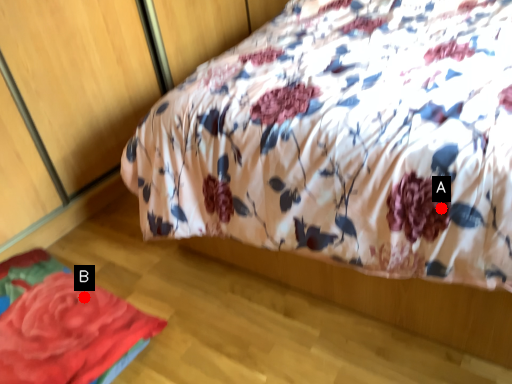
Question: Two points are circled on the image, labeled by A and B beside each circle. Which point is closer to the camera?

Choices:
 (A) A is closer
 (B) B is closer

Answer: (A)